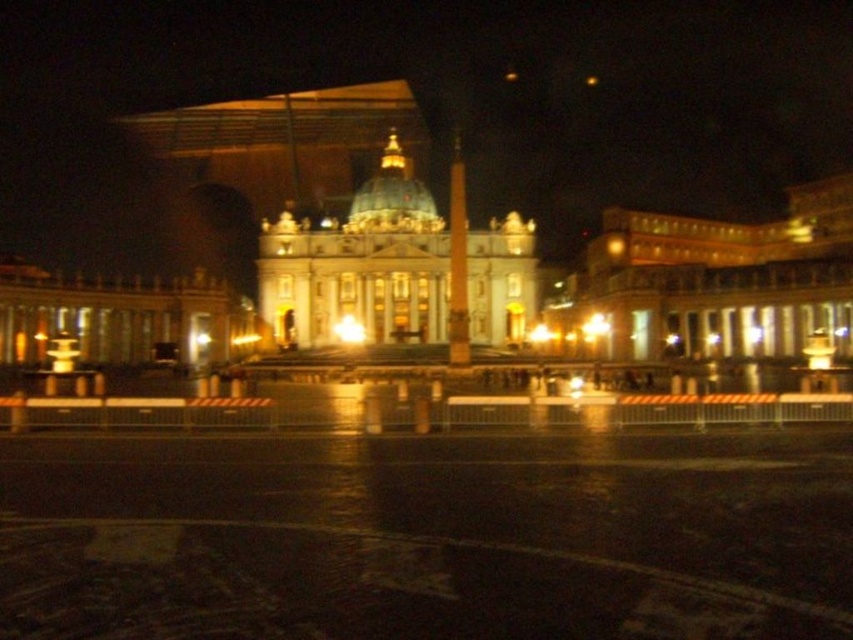
This screenshot has width=853, height=640. Describe the element at coordinates (712, 284) in the screenshot. I see `light brown stone building at right` at that location.

From the picture: Between light brown stone building at right and white marble palace at center, which one appears on the right side from the viewer's perspective?

light brown stone building at right

Measure the distance between light brown stone building at right and camera.

The distance of light brown stone building at right from camera is 115.57 meters.

What are the coordinates of `light brown stone building at right` in the screenshot? It's located at (712, 284).

Who is more distant from viewer, [432,244] or [463,280]?

The point [432,244] is behind.

Can you confirm if white marble palace at center is positioned above matte gold obelisk at center?

No.

Is point (434, 211) positioned behind point (457, 257)?

Yes.

Locate an element on the screen. This screenshot has height=640, width=853. white marble palace at center is located at coordinates pyautogui.click(x=360, y=266).

Is point (802, 316) positioned in front of point (450, 179)?

Yes, it is in front of point (450, 179).

Between point (651, 292) and point (457, 157), which one is positioned behind?

Positioned behind is point (457, 157).

Is point (608, 310) closer to camera compared to point (451, 250)?

Yes, point (608, 310) is in front of point (451, 250).

Where is `light brown stone building at right`? The image size is (853, 640). light brown stone building at right is located at coordinates (712, 284).